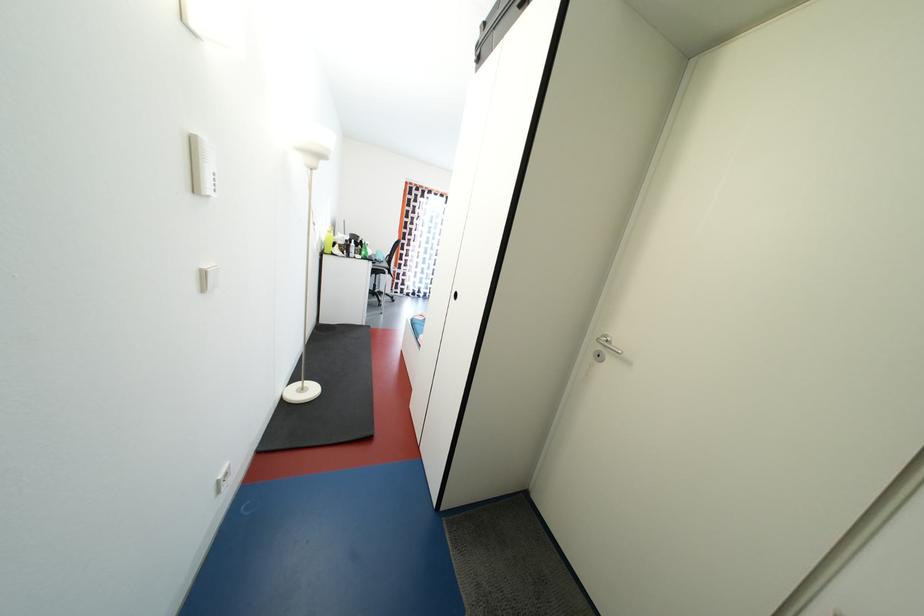
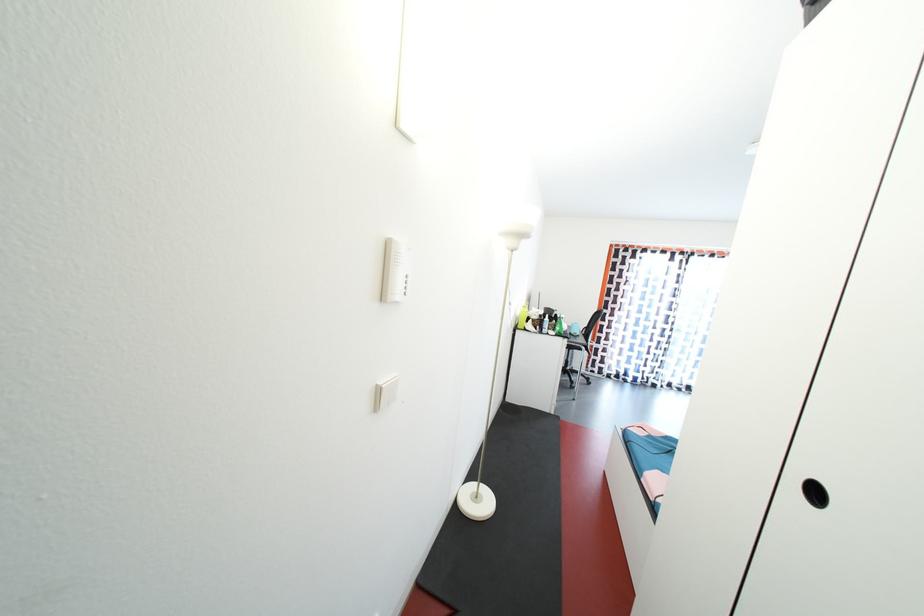
Question: I am providing you with two images of the same scene from different viewpoints. Which of the following objects are not visible in image2?

Choices:
 (A) green spray bottle
 (B) black bottle
 (C) white light switch
 (D) none of these

Answer: (D)